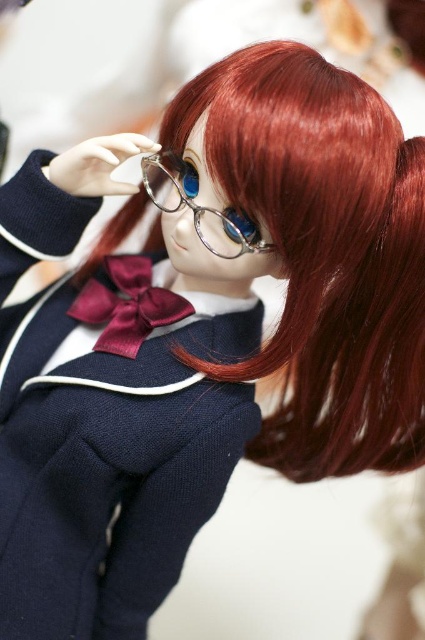
Does satin burgundy bow tie at center appear on the left side of clear plastic glasses at center?

Correct, you'll find satin burgundy bow tie at center to the left of clear plastic glasses at center.

Is satin burgundy bow tie at center to the right of clear plastic glasses at center from the viewer's perspective?

In fact, satin burgundy bow tie at center is to the left of clear plastic glasses at center.

Who is more distant from viewer, (104, 284) or (173, 179)?

The point (104, 284) is more distant.

Identify the location of satin burgundy bow tie at center. The image size is (425, 640). (125, 305).